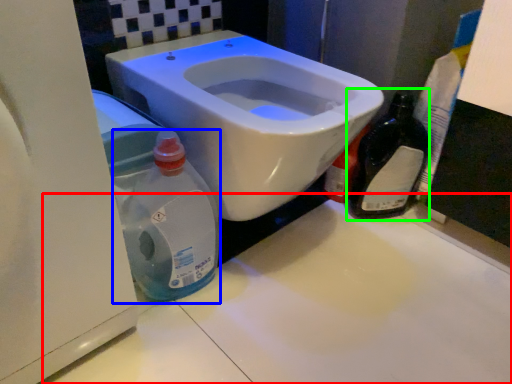
Question: Which is farther away from counter top (highlighted by a red box)? cleaning product (highlighted by a blue box) or bottle (highlighted by a green box)?

Choices:
 (A) cleaning product
 (B) bottle

Answer: (B)